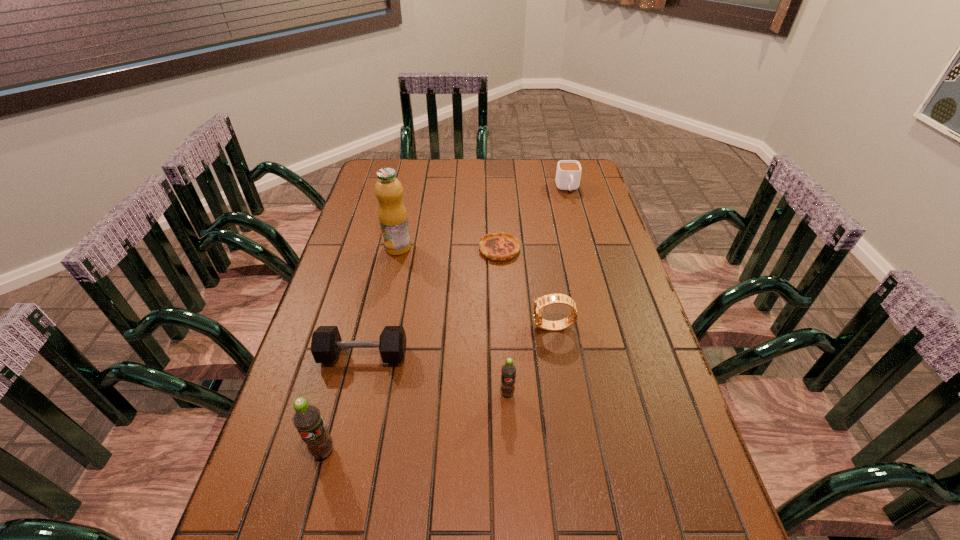
In the image, there is a desktop. Where is `free space at the far right corner`? free space at the far right corner is located at coordinates (583, 170).

You are a GUI agent. You are given a task and a screenshot of the screen. Output one action in this format:
    pyautogui.click(x=<x>, y=<y>)
    Task: Click on the free space between the rightmost object and the fruit juice
    The image size is (960, 540).
    Given the screenshot: What is the action you would take?
    pyautogui.click(x=483, y=218)

The width and height of the screenshot is (960, 540). Identify the location of unoccupied position between the rightmost object and the third nearest object. (466, 272).

Find the location of a particular element. free space between the dumbbell and the quiche is located at coordinates (431, 302).

Find the location of `vacant space in between the farthest object and the sixth shortest object`. vacant space in between the farthest object and the sixth shortest object is located at coordinates (445, 320).

Identify the location of unoccupied area between the right soda and the shortest object. The width and height of the screenshot is (960, 540). (503, 321).

Where is `vacant region between the fourth tallest object and the fruit juice`? The height and width of the screenshot is (540, 960). vacant region between the fourth tallest object and the fruit juice is located at coordinates (476, 287).

Locate an element on the screen. free space between the fourth shortest object and the dumbbell is located at coordinates (458, 342).

Where is `free space between the quiche and the nearer soda`? The width and height of the screenshot is (960, 540). free space between the quiche and the nearer soda is located at coordinates (412, 350).

Locate an element on the screen. vacant space that's between the sixth object from left to right and the nearest object is located at coordinates (439, 389).